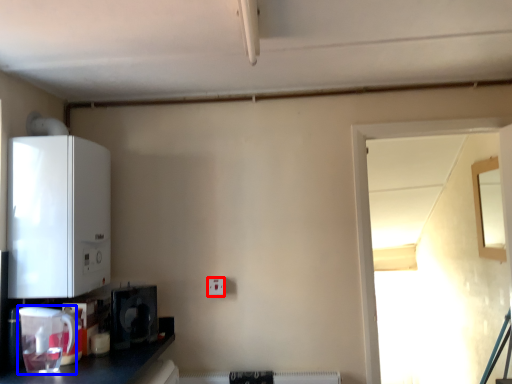
Question: Among these objects, which one is nearest to the camera, electric outlet (highlighted by a red box) or appliance (highlighted by a blue box)?

Choices:
 (A) electric outlet
 (B) appliance

Answer: (B)